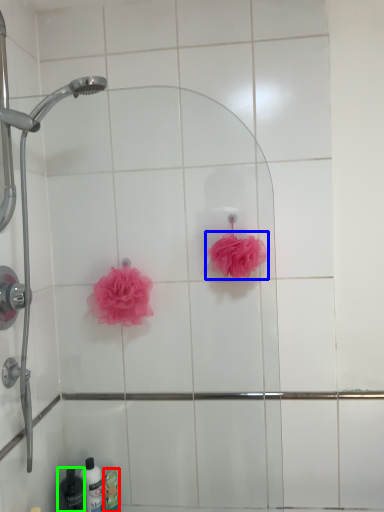
Question: Which object is the farthest from toiletry (highlighted by a red box)? Choose among these: rose (highlighted by a blue box) or toiletry (highlighted by a green box).

Choices:
 (A) rose
 (B) toiletry

Answer: (A)